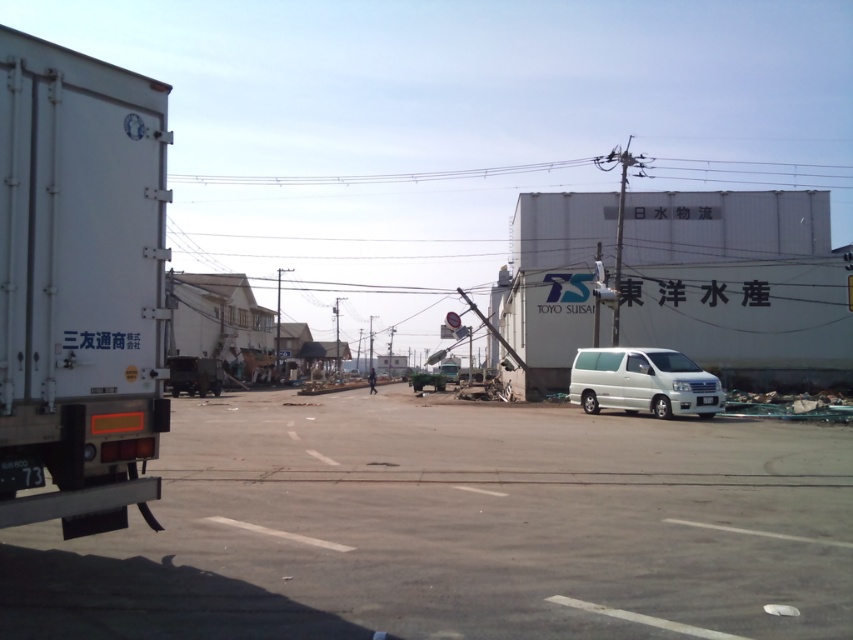
Question: Is white matte truck at left smaller than white metallic van at center?

Choices:
 (A) yes
 (B) no

Answer: (A)

Question: Is gray asphalt parking lot at center positioned before white matte truck at left?

Choices:
 (A) no
 (B) yes

Answer: (B)

Question: Based on their relative distances, which object is farther from the white matte truck at left?

Choices:
 (A) white metallic van at center
 (B) gray asphalt parking lot at center

Answer: (A)

Question: Which object appears closest to the camera in this image?

Choices:
 (A) white matte truck at left
 (B) gray asphalt parking lot at center

Answer: (B)

Question: Which point is farther from the camera taking this photo?

Choices:
 (A) (712, 401)
 (B) (67, 525)
 (C) (677, 538)

Answer: (A)

Question: Is gray asphalt parking lot at center positioned in front of white metallic van at center?

Choices:
 (A) no
 (B) yes

Answer: (B)